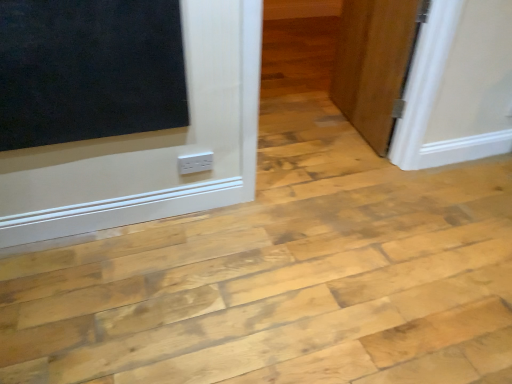
Where is `free spot behind wooden door at right`? This screenshot has width=512, height=384. free spot behind wooden door at right is located at coordinates pyautogui.click(x=303, y=90).